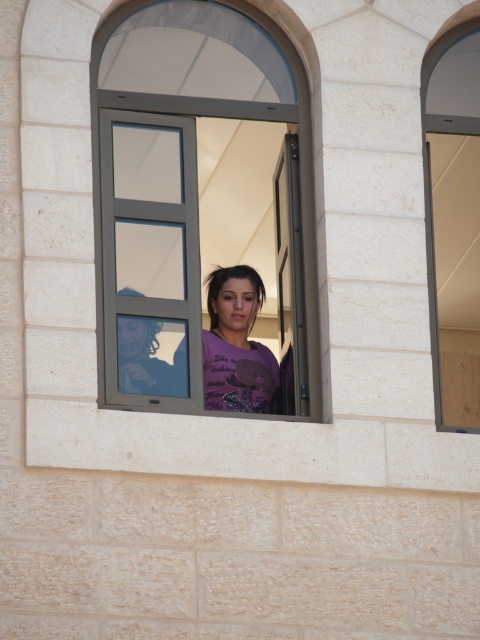
Question: Does metallic gray window at center lie in front of matte gray window at right?

Choices:
 (A) no
 (B) yes

Answer: (B)

Question: Which object is positioned farthest from the metallic gray window at center?

Choices:
 (A) matte gray window at right
 (B) purple matte shirt at center

Answer: (A)

Question: Which object is farther from the camera taking this photo?

Choices:
 (A) purple matte shirt at center
 (B) metallic gray window at center

Answer: (A)

Question: Does metallic gray window at center appear on the right side of matte gray window at right?

Choices:
 (A) yes
 (B) no

Answer: (B)

Question: Is the position of metallic gray window at center more distant than that of matte gray window at right?

Choices:
 (A) yes
 (B) no

Answer: (B)

Question: Which of these objects is positioned farthest from the purple matte shirt at center?

Choices:
 (A) matte gray window at right
 (B) metallic gray window at center

Answer: (A)